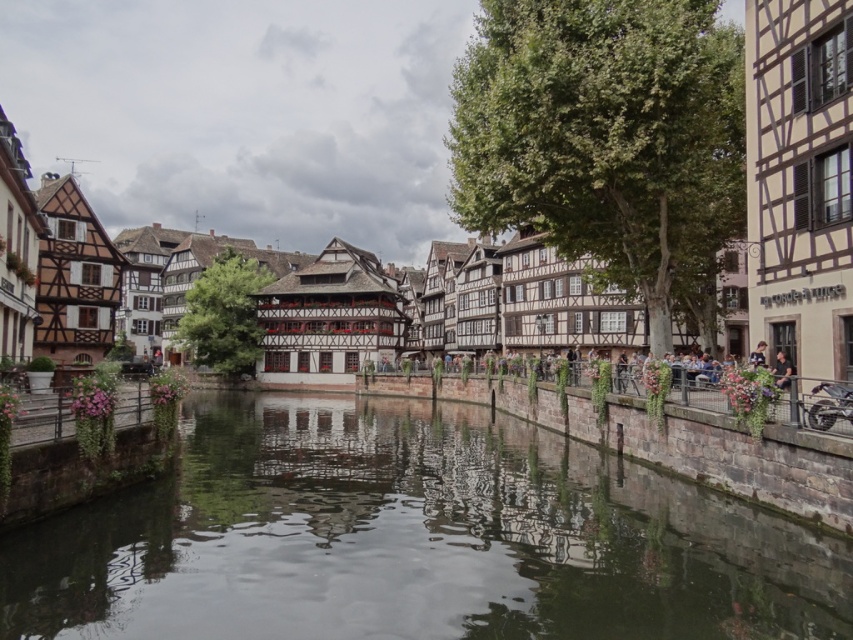
Question: Which point is farther to the camera?

Choices:
 (A) (286, 125)
 (B) (184, 504)

Answer: (A)

Question: Which object appears closest to the camera in this image?

Choices:
 (A) brown timbered houses at center
 (B) smooth concrete river at center

Answer: (B)

Question: Can you confirm if smooth concrete river at center is positioned to the left of brown timbered houses at center?

Choices:
 (A) yes
 (B) no

Answer: (B)

Question: Does smooth concrete river at center come in front of brown timbered houses at center?

Choices:
 (A) yes
 (B) no

Answer: (A)

Question: Can you confirm if smooth concrete river at center is positioned above brown timbered houses at center?

Choices:
 (A) no
 (B) yes

Answer: (A)

Question: Which point is farther from the camera taking this photo?

Choices:
 (A) (334, 202)
 (B) (345, 442)

Answer: (A)